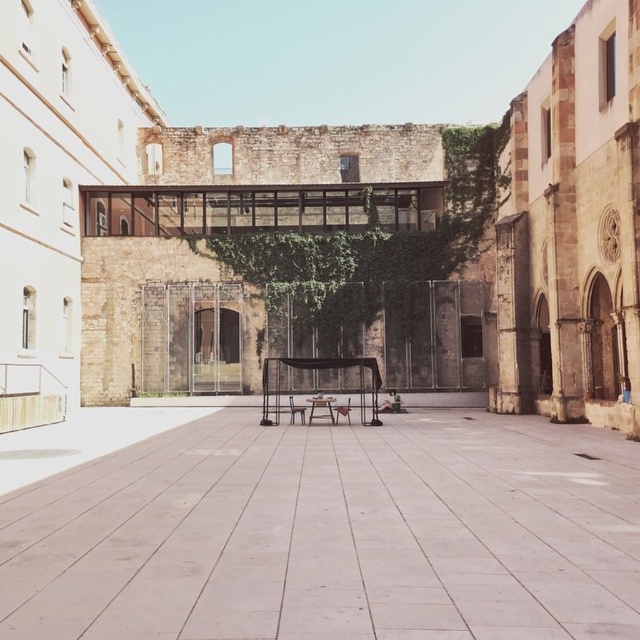
Is point (29, 561) positioned after point (292, 413)?

No.

Identify the location of smooth concrete alley at center. 332,534.